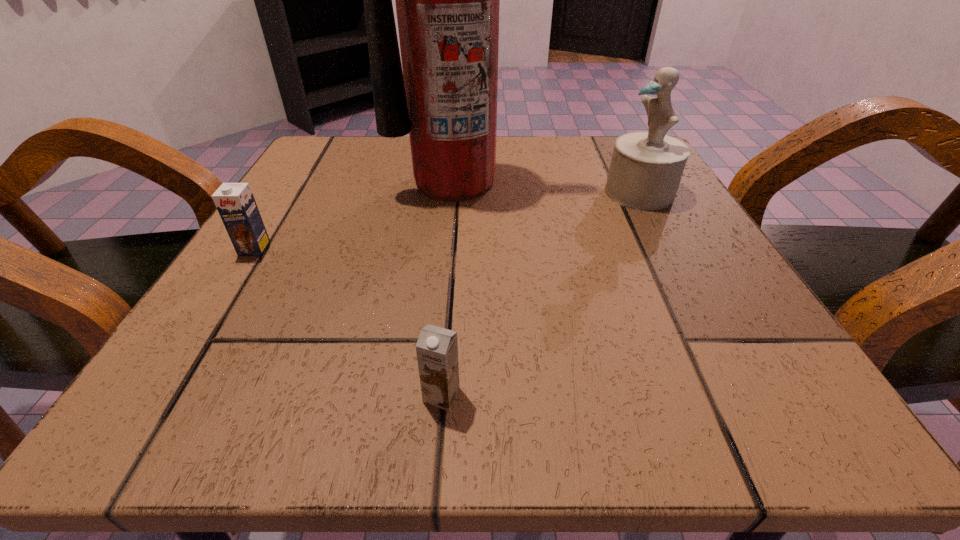
Where is `free space that is in between the rightmost object and the leftmost object`? free space that is in between the rightmost object and the leftmost object is located at coordinates (447, 220).

You are a GUI agent. You are given a task and a screenshot of the screen. Output one action in this format:
    pyautogui.click(x=<x>, y=<y>)
    Task: Click on the free spot between the tallest object and the right chocolate milk
    The image size is (960, 540).
    Given the screenshot: What is the action you would take?
    pyautogui.click(x=447, y=288)

Find the location of `vacant point located between the figurine and the farther chocolate milk`. vacant point located between the figurine and the farther chocolate milk is located at coordinates (447, 220).

Find the location of a particular element. This screenshot has width=960, height=540. empty space between the fire extinguisher and the nearer chocolate milk is located at coordinates (447, 288).

Identify the location of empty space that is in between the fire extinguisher and the nearest object. (447, 288).

Identify the location of free space between the tallest object and the right chocolate milk. (447, 288).

Where is `object that is the closest one to the figurine`? This screenshot has height=540, width=960. object that is the closest one to the figurine is located at coordinates (447, 0).

Identify the location of the third closest object to the rightmost object. (235, 202).

The height and width of the screenshot is (540, 960). What are the coordinates of `free location that satisfies the following two spatial constraints: 1. on the front of the fire extinguisher near the operation label; 2. on the right side of the nearer chocolate milk` in the screenshot? It's located at (435, 395).

At what (x,y) coordinates should I click in order to perform the action: click on vacant region that satisfies the following two spatial constraints: 1. on the front of the right chocolate milk near the operation label; 2. on the left side of the tallest object. Please return your answer as a coordinate pair (x, y). The image size is (960, 540). Looking at the image, I should click on (435, 395).